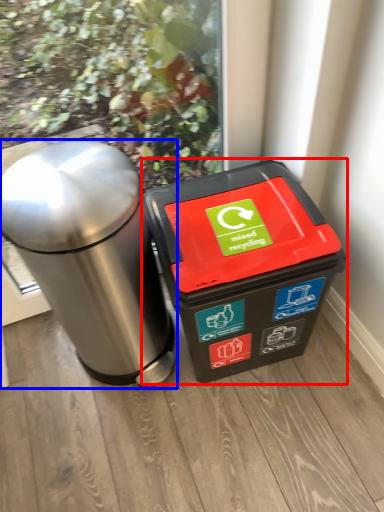
Question: Among these objects, which one is farthest to the camera, waste container (highlighted by a red box) or waste container (highlighted by a blue box)?

Choices:
 (A) waste container
 (B) waste container

Answer: (A)